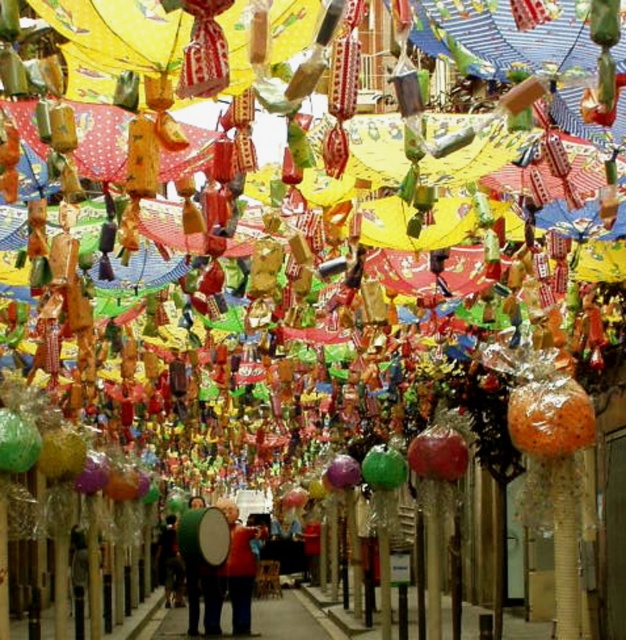
Question: Can you confirm if green matte drum at center is positioned below dark brown leather jacket at lower left?

Choices:
 (A) yes
 (B) no

Answer: (B)

Question: Which point appears closest to the camera in this image?

Choices:
 (A) (177, 561)
 (B) (252, 554)
 (C) (185, 516)

Answer: (C)

Question: Is red fabric jacket at center positioned before dark brown leather jacket at lower left?

Choices:
 (A) yes
 (B) no

Answer: (A)

Question: Which point is farther to the camera?

Choices:
 (A) green matte drum at center
 (B) dark brown leather jacket at lower left

Answer: (B)

Question: Does red fabric jacket at center lie behind dark brown leather jacket at lower left?

Choices:
 (A) yes
 (B) no

Answer: (B)

Question: Which point is farther to the camera?

Choices:
 (A) (182, 582)
 (B) (195, 570)

Answer: (A)